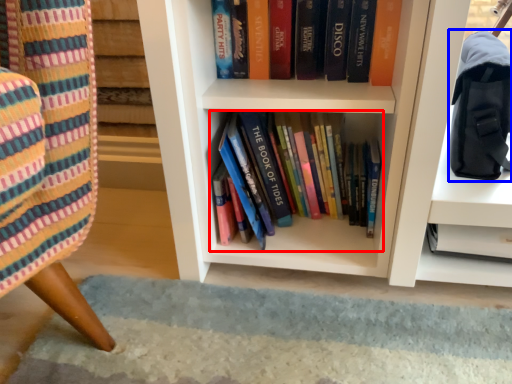
Question: Which object is closer to the camera taking this photo, book (highlighted by a red box) or shoulder bag (highlighted by a blue box)?

Choices:
 (A) book
 (B) shoulder bag

Answer: (B)